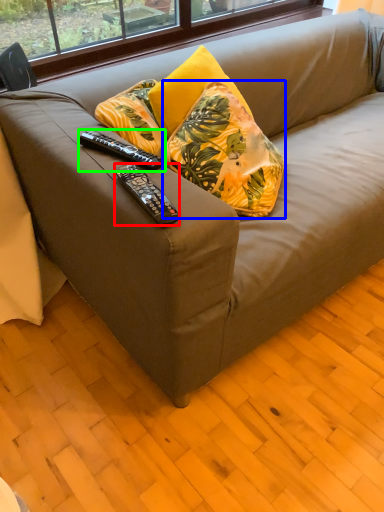
Question: Considering the real-world distances, which object is farthest from remote control (highlighted by a red box)? pillow (highlighted by a blue box) or remote control (highlighted by a green box)?

Choices:
 (A) pillow
 (B) remote control

Answer: (A)